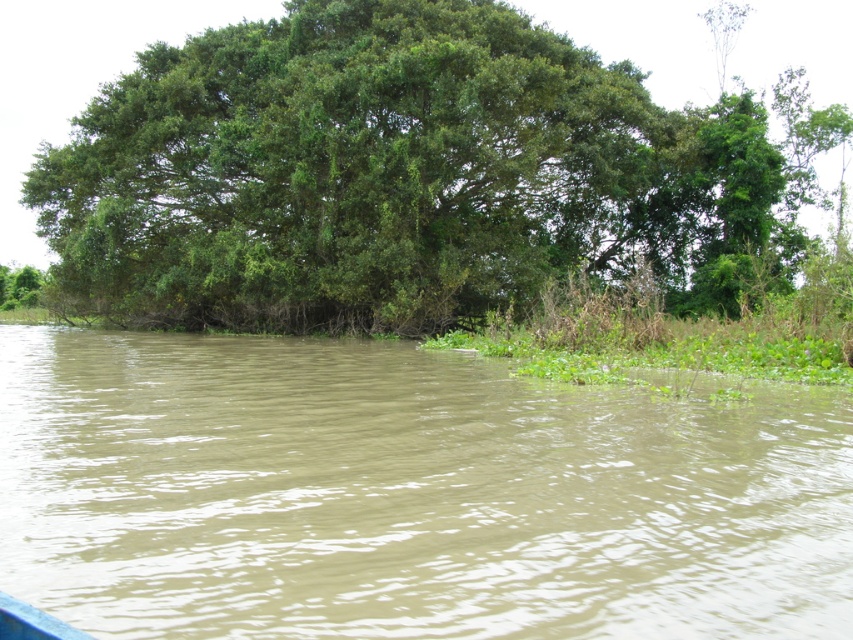
Question: Can you confirm if brown muddy water at center is bigger than green leafy tree at upper center?

Choices:
 (A) yes
 (B) no

Answer: (B)

Question: Is brown muddy water at center positioned at the back of green leafy tree at upper center?

Choices:
 (A) no
 (B) yes

Answer: (A)

Question: Is brown muddy water at center to the left of green leafy tree at upper center from the viewer's perspective?

Choices:
 (A) yes
 (B) no

Answer: (A)

Question: Which object is closer to the camera taking this photo?

Choices:
 (A) green leafy tree at upper center
 (B) brown muddy water at center

Answer: (B)